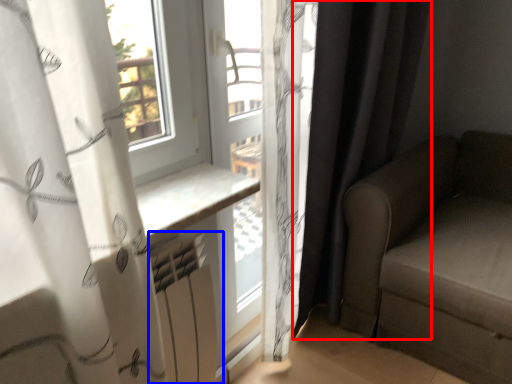
Question: Which of the following is the farthest to the observer, curtain (highlighted by a red box) or radiator (highlighted by a blue box)?

Choices:
 (A) curtain
 (B) radiator

Answer: (A)